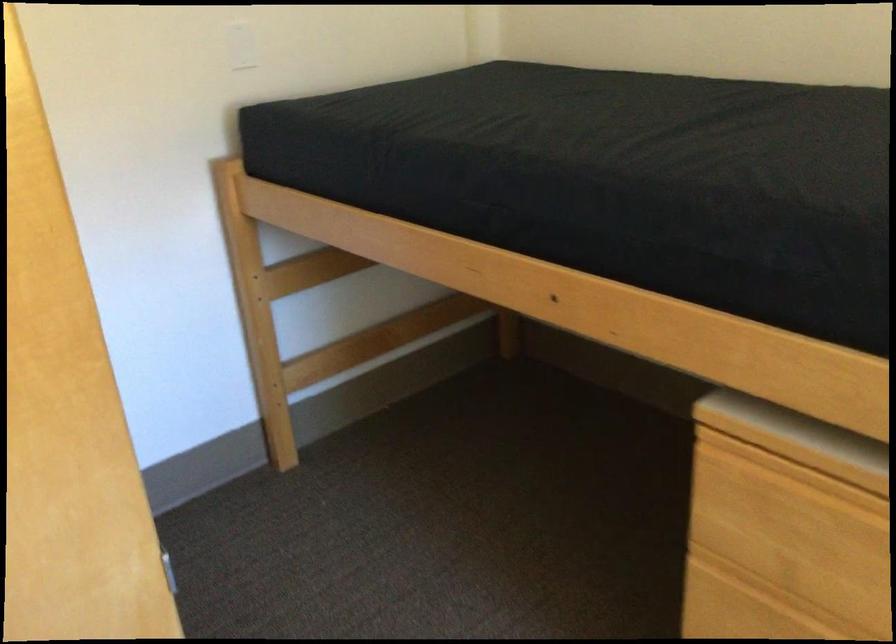
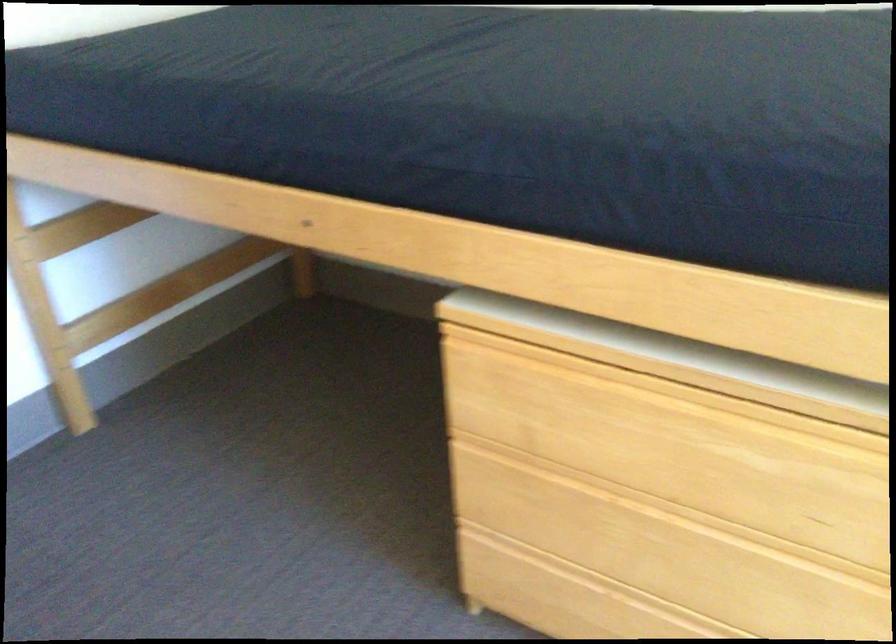
Question: Based on the continuous images, in which direction is the camera rotating? Reply with the corresponding letter.

Choices:
 (A) Left
 (B) Right
 (C) Up
 (D) Down

Answer: (B)